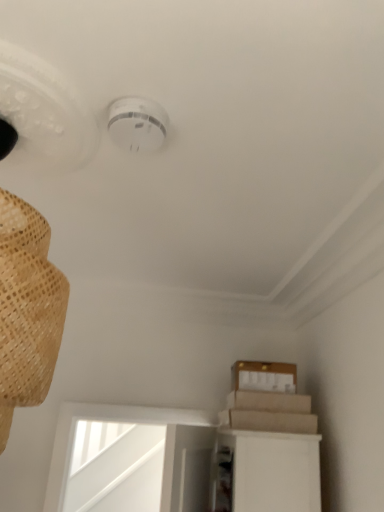
Image resolution: width=384 pixels, height=512 pixels. What do you see at coordinates (264, 376) in the screenshot? I see `brown cardboard at upper right` at bounding box center [264, 376].

This screenshot has height=512, width=384. In order to click on brown cardboard at upper right in this screenshot , I will do `click(264, 376)`.

In the scene shown: What is the approximate width of brown cardboard at upper right?

brown cardboard at upper right is 29.43 centimeters in width.

The height and width of the screenshot is (512, 384). I want to click on white plastic smoke detector at upper center, so 137,124.

What do you see at coordinates (137, 124) in the screenshot? Image resolution: width=384 pixels, height=512 pixels. I see `white plastic smoke detector at upper center` at bounding box center [137, 124].

What is the approximate width of white plastic smoke detector at upper center?

white plastic smoke detector at upper center is 6.97 inches in width.

I want to click on brown cardboard at upper right, so click(x=264, y=376).

Which object is positioned more to the right, brown cardboard at upper right or white plastic smoke detector at upper center?

brown cardboard at upper right.

Based on the photo, is the position of brown cardboard at upper right more distant than that of white plastic smoke detector at upper center?

Yes, the depth of brown cardboard at upper right is greater than that of white plastic smoke detector at upper center.

Considering the positions of point (284, 391) and point (154, 103), is point (284, 391) closer or farther from the camera than point (154, 103)?

Point (284, 391) appears to be farther away from the viewer than point (154, 103).

From the image's perspective, is brown cardboard at upper right on white plastic smoke detector at upper center?

No.

From a real-world perspective, between brown cardboard at upper right and white plastic smoke detector at upper center, who is vertically higher?

In real-world perspective, white plastic smoke detector at upper center is above.

Which object is thinner, brown cardboard at upper right or white plastic smoke detector at upper center?

white plastic smoke detector at upper center is thinner.

Who is shorter, brown cardboard at upper right or white plastic smoke detector at upper center?

white plastic smoke detector at upper center.

Which of these two, brown cardboard at upper right or white plastic smoke detector at upper center, is bigger?

brown cardboard at upper right.

Is white plastic smoke detector at upper center located within brown cardboard at upper right?

No, white plastic smoke detector at upper center is not surrounded by brown cardboard at upper right.

Does brown cardboard at upper right touch white plastic smoke detector at upper center?

No, brown cardboard at upper right is not beside white plastic smoke detector at upper center.

Is brown cardboard at upper right oriented away from white plastic smoke detector at upper center?

brown cardboard at upper right does not have its back to white plastic smoke detector at upper center.

The height and width of the screenshot is (512, 384). I want to click on cardboard box to the right of white plastic smoke detector at upper center, so tap(264, 376).

Can you confirm if white plastic smoke detector at upper center is positioned to the right of brown cardboard at upper right?

In fact, white plastic smoke detector at upper center is to the left of brown cardboard at upper right.

Considering the positions of objects white plastic smoke detector at upper center and brown cardboard at upper right in the image provided, who is behind, white plastic smoke detector at upper center or brown cardboard at upper right?

brown cardboard at upper right.

Is point (137, 108) farther from camera compared to point (242, 380)?

No.

From the image's perspective, is white plastic smoke detector at upper center over brown cardboard at upper right?

Yes.

From a real-world perspective, is white plastic smoke detector at upper center above or below brown cardboard at upper right?

From a real-world perspective, white plastic smoke detector at upper center is physically above brown cardboard at upper right.

Is white plastic smoke detector at upper center thinner than brown cardboard at upper right?

Indeed, white plastic smoke detector at upper center has a lesser width compared to brown cardboard at upper right.

Between white plastic smoke detector at upper center and brown cardboard at upper right, which one has more height?

brown cardboard at upper right.

In terms of size, does white plastic smoke detector at upper center appear bigger or smaller than brown cardboard at upper right?

white plastic smoke detector at upper center is smaller than brown cardboard at upper right.

Would you say white plastic smoke detector at upper center is inside or outside brown cardboard at upper right?

white plastic smoke detector at upper center exists outside the volume of brown cardboard at upper right.

Is white plastic smoke detector at upper center not near brown cardboard at upper right?

white plastic smoke detector at upper center is positioned a significant distance from brown cardboard at upper right.

Could you tell me if white plastic smoke detector at upper center is turned towards brown cardboard at upper right?

No, white plastic smoke detector at upper center is not facing towards brown cardboard at upper right.

Identify the location of lamp that is above the brown cardboard at upper right (from a real-world perspective). (137, 124).

What are the coordinates of `cardboard box behind the white plastic smoke detector at upper center` in the screenshot? It's located at (264, 376).

Where is `cardboard box on the right of white plastic smoke detector at upper center`? The height and width of the screenshot is (512, 384). cardboard box on the right of white plastic smoke detector at upper center is located at coordinates (264, 376).